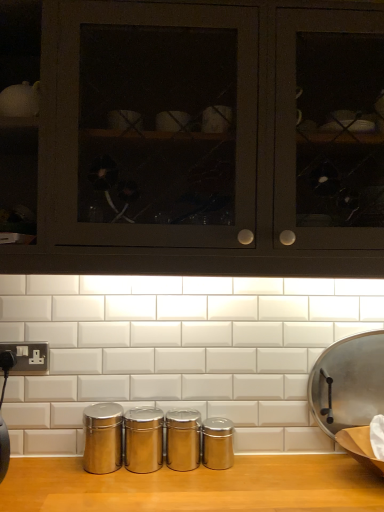
Question: Does metallic silver frying pan at right lie in front of matte black cabinets at upper center?

Choices:
 (A) no
 (B) yes

Answer: (A)

Question: Is metallic silver frying pan at right positioned behind matte black cabinets at upper center?

Choices:
 (A) yes
 (B) no

Answer: (A)

Question: Considering the relative positions of metallic silver frying pan at right and matte black cabinets at upper center in the image provided, is metallic silver frying pan at right to the left of matte black cabinets at upper center from the viewer's perspective?

Choices:
 (A) yes
 (B) no

Answer: (B)

Question: From a real-world perspective, is metallic silver frying pan at right on matte black cabinets at upper center?

Choices:
 (A) yes
 (B) no

Answer: (B)

Question: Does metallic silver frying pan at right have a larger size compared to matte black cabinets at upper center?

Choices:
 (A) no
 (B) yes

Answer: (A)

Question: Would you say matte black cabinets at upper center is part of metallic silver frying pan at right's contents?

Choices:
 (A) yes
 (B) no

Answer: (B)

Question: Is metallic silver frying pan at right shorter than silver metallic plug socket at lower left?

Choices:
 (A) yes
 (B) no

Answer: (B)

Question: From a real-world perspective, is metallic silver frying pan at right under silver metallic plug socket at lower left?

Choices:
 (A) no
 (B) yes

Answer: (B)

Question: Is metallic silver frying pan at right bigger than silver metallic plug socket at lower left?

Choices:
 (A) yes
 (B) no

Answer: (A)

Question: Is the depth of metallic silver frying pan at right greater than that of silver metallic plug socket at lower left?

Choices:
 (A) yes
 (B) no

Answer: (B)

Question: Does metallic silver frying pan at right have a lesser width compared to silver metallic plug socket at lower left?

Choices:
 (A) yes
 (B) no

Answer: (B)

Question: Is metallic silver frying pan at right smaller than silver metallic plug socket at lower left?

Choices:
 (A) no
 (B) yes

Answer: (A)

Question: From a real-world perspective, is silver metallic plug socket at lower left physically below matte black cabinets at upper center?

Choices:
 (A) no
 (B) yes

Answer: (B)